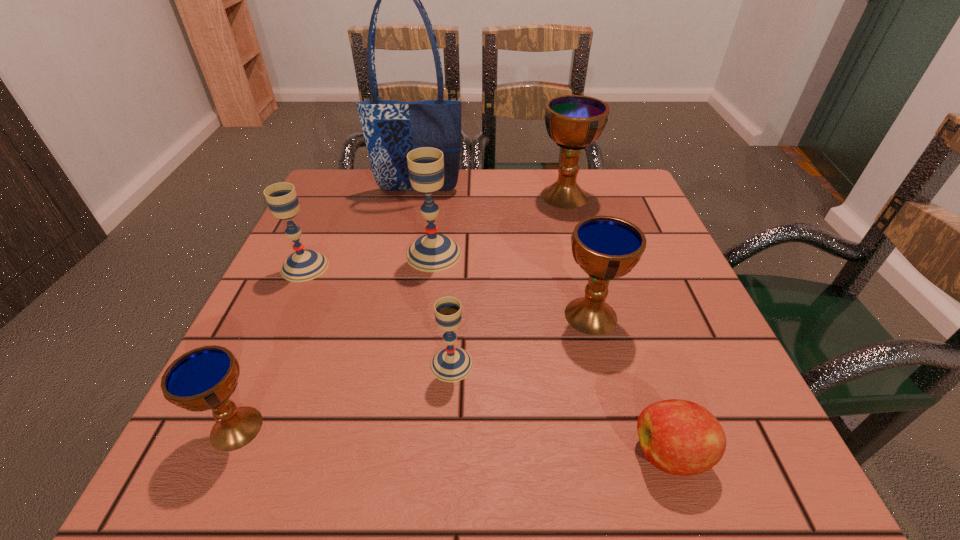
You are a GUI agent. You are given a task and a screenshot of the screen. Output one action in this format:
    pyautogui.click(x=<x>, y=<y>)
    Task: Click on the shopping bag
    
    Given the screenshot: What is the action you would take?
    (391, 129)

At what (x,y) coordinates should I click in order to perform the action: click on the biggest blue chalice. Please return your answer as a coordinate pair (x, y). Image resolution: width=960 pixels, height=540 pixels. Looking at the image, I should click on (572, 121).

You are a GUI agent. You are given a task and a screenshot of the screen. Output one action in this format:
    pyautogui.click(x=<x>, y=<y>)
    Task: Click on the farthest blue chalice
    The height and width of the screenshot is (540, 960).
    Given the screenshot: What is the action you would take?
    pyautogui.click(x=572, y=121)

Where is `the biggest gray chalice`? This screenshot has width=960, height=540. the biggest gray chalice is located at coordinates (x=432, y=252).

The width and height of the screenshot is (960, 540). Find the location of `the fourth nearest object`. the fourth nearest object is located at coordinates (605, 247).

Where is `the second farthest blue chalice`? The height and width of the screenshot is (540, 960). the second farthest blue chalice is located at coordinates (605, 247).

The width and height of the screenshot is (960, 540). Identify the location of the leftmost gray chalice. (303, 265).

Image resolution: width=960 pixels, height=540 pixels. I want to click on the nearest chalice, so click(x=204, y=378).

Where is `the leftmost blue chalice`? The image size is (960, 540). the leftmost blue chalice is located at coordinates (204, 378).

Identify the location of the third nearest object. (450, 364).